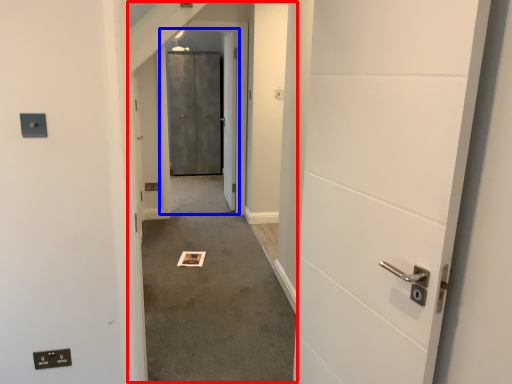
Question: Among these objects, which one is farthest to the camera, corridor (highlighted by a red box) or elevator door (highlighted by a blue box)?

Choices:
 (A) corridor
 (B) elevator door

Answer: (B)